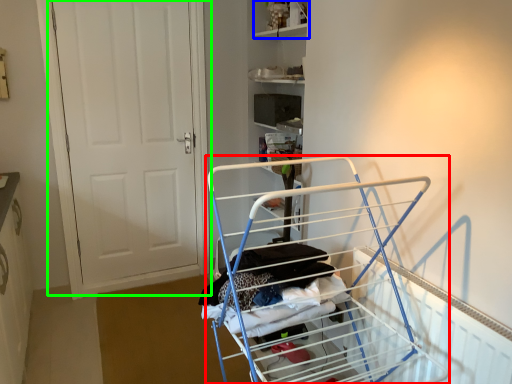
Question: Estimate the real-world distances between objects in this image. Which object is farther from furniture (highlighted by a red box), shelf (highlighted by a blue box) or door (highlighted by a green box)?

Choices:
 (A) shelf
 (B) door

Answer: (A)